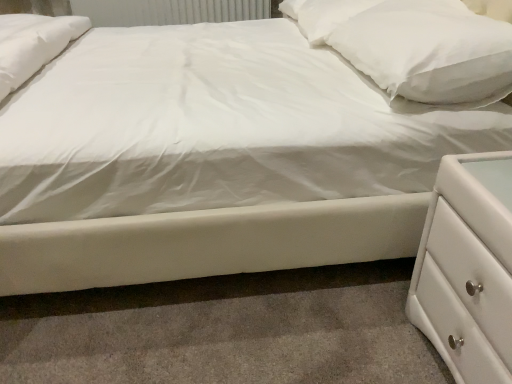
Question: From a real-world perspective, is white soft pillow at upper right, the 1th pillow in the back-to-front sequence, located higher than white soft pillow at upper right, the 2th pillow when ordered from back to front?

Choices:
 (A) yes
 (B) no

Answer: (B)

Question: Is white soft pillow at upper right, the 2th pillow when ordered from back to front, at the back of white soft pillow at upper right, the 1th pillow in the back-to-front sequence?

Choices:
 (A) yes
 (B) no

Answer: (B)

Question: Is white soft pillow at upper right, the 1th pillow in the back-to-front sequence, taller than white soft pillow at upper right, the 1th pillow when ordered from front to back?

Choices:
 (A) yes
 (B) no

Answer: (B)

Question: Can you confirm if white soft pillow at upper right, the 1th pillow in the back-to-front sequence, is wider than white soft pillow at upper right, the 2th pillow when ordered from back to front?

Choices:
 (A) no
 (B) yes

Answer: (B)

Question: Is white soft pillow at upper right, which ranks as the 2th pillow in front-to-back order, to the left of white soft pillow at upper right, the 1th pillow when ordered from front to back, from the viewer's perspective?

Choices:
 (A) no
 (B) yes

Answer: (B)

Question: Does white soft pillow at upper right, the 1th pillow in the back-to-front sequence, have a lesser height compared to white soft pillow at upper right, the 2th pillow when ordered from back to front?

Choices:
 (A) no
 (B) yes

Answer: (B)

Question: Is white textured radiator at upper center looking in the opposite direction of white glossy chest of drawers at lower right?

Choices:
 (A) yes
 (B) no

Answer: (B)

Question: Can you confirm if white textured radiator at upper center is wider than white glossy chest of drawers at lower right?

Choices:
 (A) yes
 (B) no

Answer: (B)

Question: Is white textured radiator at upper center located outside white glossy chest of drawers at lower right?

Choices:
 (A) no
 (B) yes

Answer: (B)

Question: From a real-world perspective, is white textured radiator at upper center over white glossy chest of drawers at lower right?

Choices:
 (A) yes
 (B) no

Answer: (A)

Question: From a real-world perspective, does white textured radiator at upper center sit lower than white glossy chest of drawers at lower right?

Choices:
 (A) no
 (B) yes

Answer: (A)

Question: Considering the relative positions of white textured radiator at upper center and white glossy chest of drawers at lower right in the image provided, is white textured radiator at upper center to the right of white glossy chest of drawers at lower right from the viewer's perspective?

Choices:
 (A) yes
 (B) no

Answer: (B)

Question: From the image's perspective, does white textured radiator at upper center appear lower than white soft pillow at upper right, the 1th pillow in the back-to-front sequence?

Choices:
 (A) no
 (B) yes

Answer: (A)